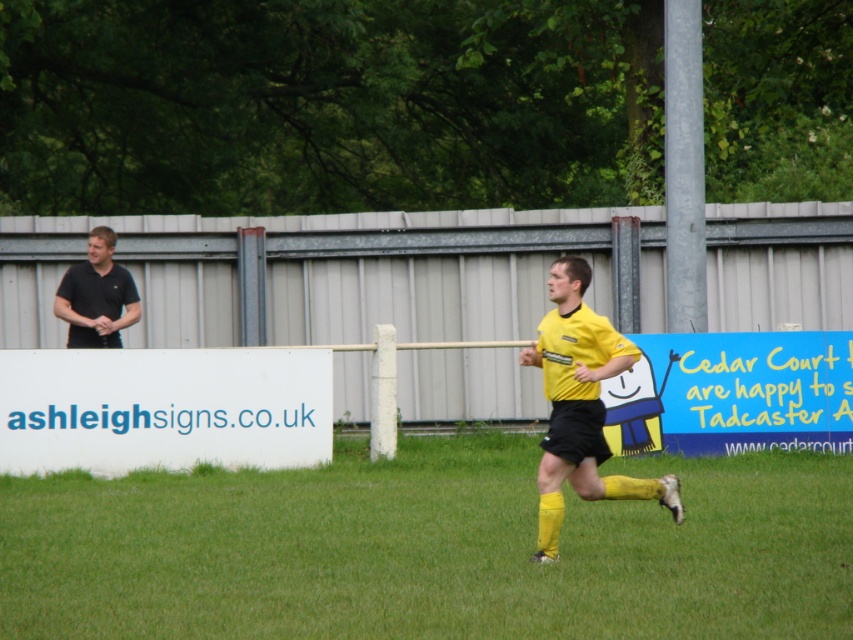
You are a soccer player on the field. You need to kick the ball from the green grass at center to the black smooth shirt at left. Which surface will the ball travel over first?

The ball will first travel over the green grass at center because it has a lesser height compared to the black smooth shirt at left, meaning the grass is lower and the shirt is higher.

You are a soccer coach analyzing the match. The field is divided into zones using a coordinate system where the bottom left corner is 0,0 and the top right is 1,1. The yellow matte jersey at center is at point 0.634, 0.681. Is the jersey located in the central midfield area, which spans from 0.4 to 0.6 on both axes?

The yellow matte jersey at center has coordinates (579, 404). The central midfield area spans from 0.4 to 0.6 on both axes. Since both coordinates are above 0.6, the jersey is outside the central midfield area.

You are a referee observing a soccer match. You notice two players wearing the yellow matte jersey at center and the black smooth shirt at left. Based on their positions, which player is closer to the ground?

The yellow matte jersey at center is closer to the ground because it is positioned below the black smooth shirt at left.